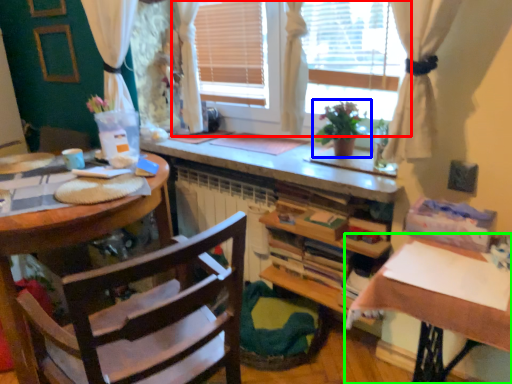
Question: Considering the real-world distances, which object is farthest from window (highlighted by a red box)? houseplant (highlighted by a blue box) or table (highlighted by a green box)?

Choices:
 (A) houseplant
 (B) table

Answer: (B)